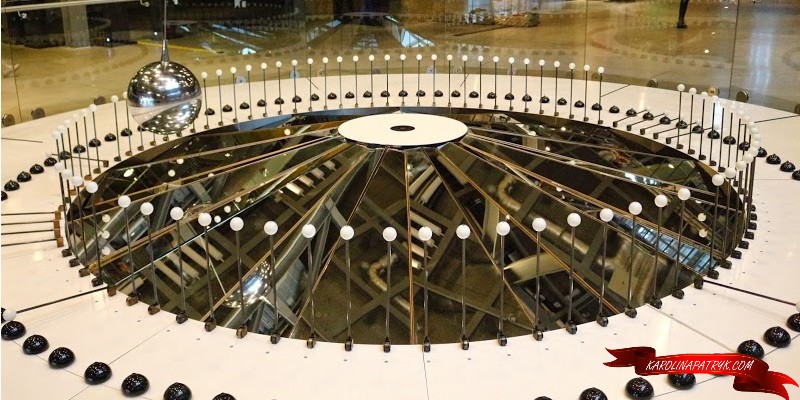
At what (x,y) coordinates should I click in order to perform the action: click on white light bulb. Please return your answer as a coordinate pair (x, y). The height and width of the screenshot is (400, 800). Looking at the image, I should click on (636, 211).